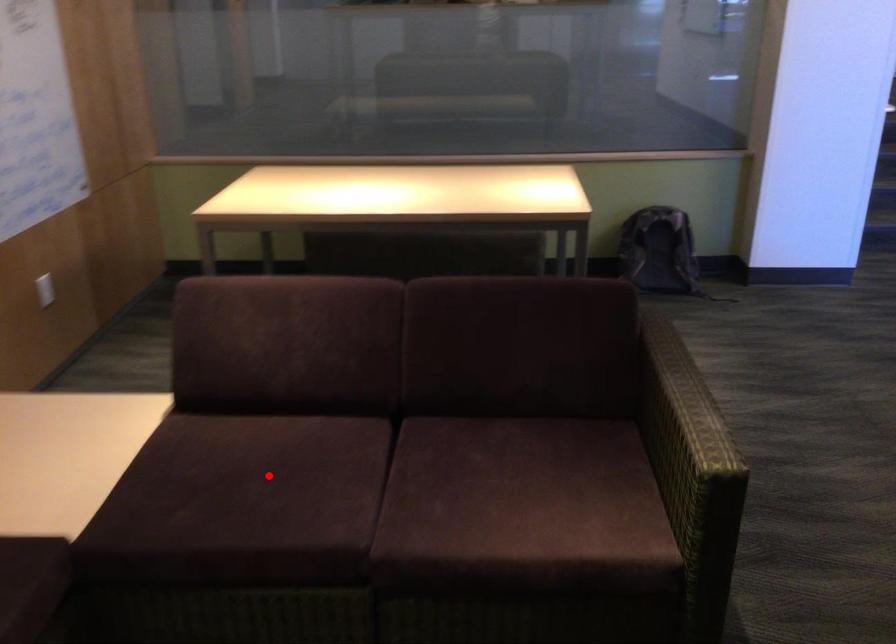
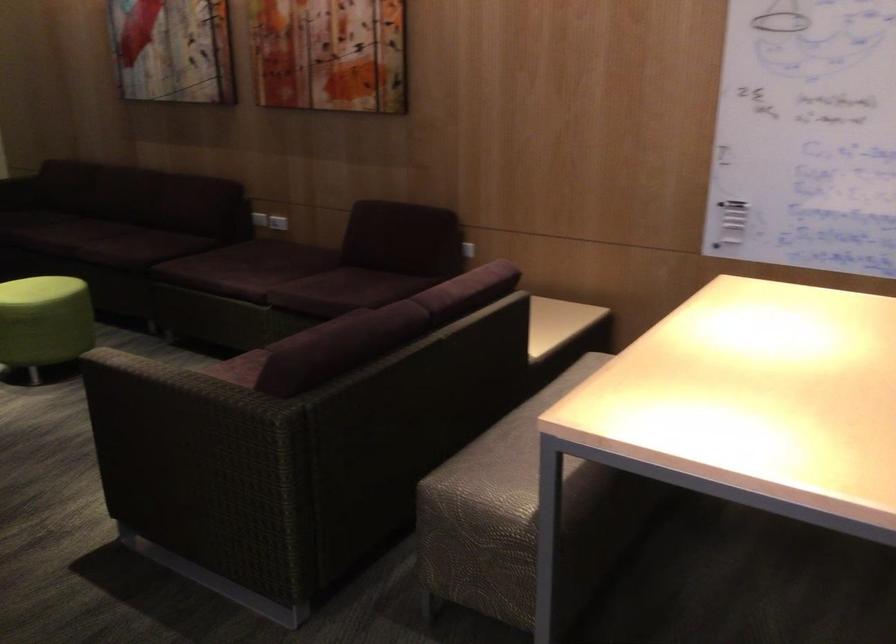
Question: I am providing you with two images of the same scene from different viewpoints. A red point is marked on the first image. Can you still see the location of the red point in image 2?

Choices:
 (A) Yes
 (B) No

Answer: (B)